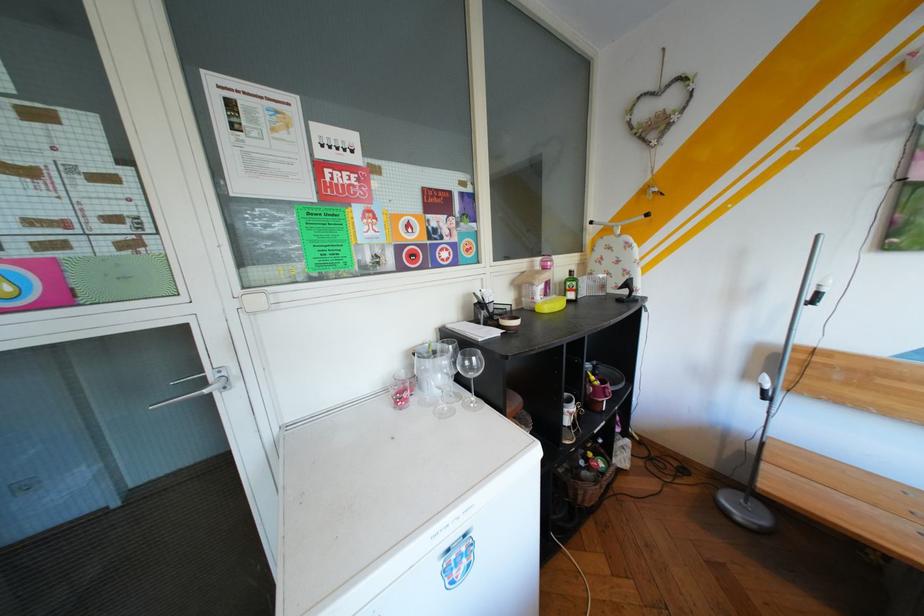
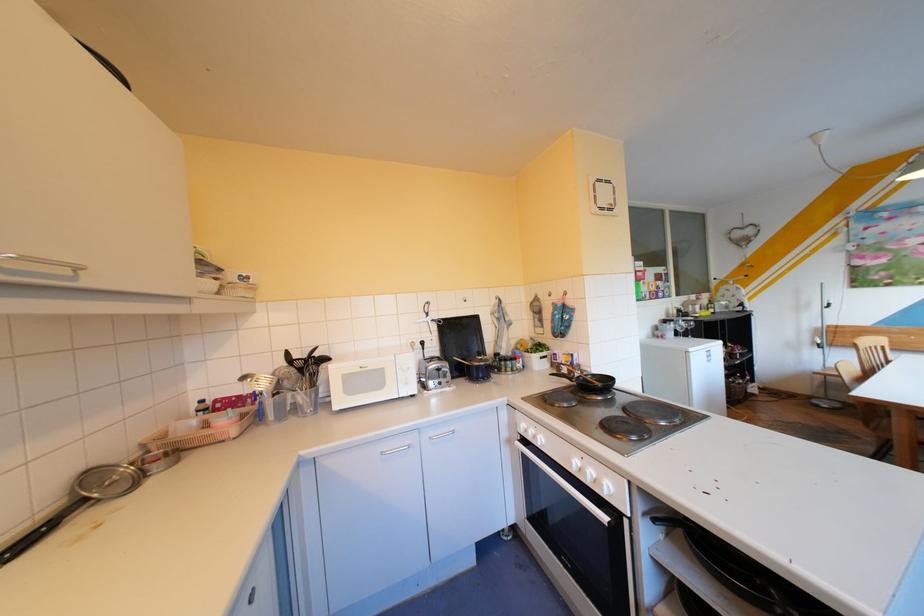
What movement of the cameraman would produce the second image?

The movement direction of the cameraman is left, backward.